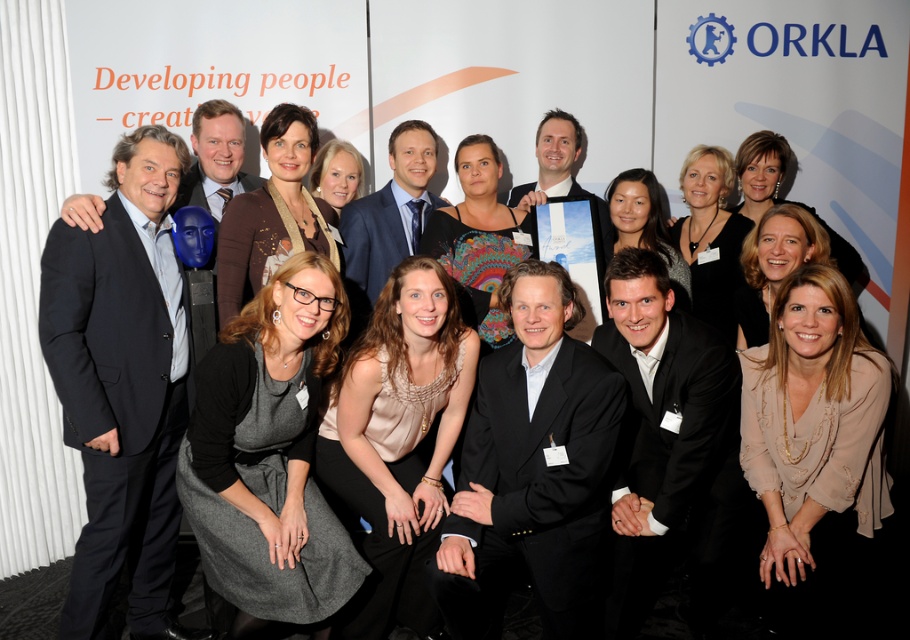
You are a photographer at the event and need to ensure everyone fits in the photo. The black suit at center and gray wool dress at center are currently overlapping. Which one should you ask to move slightly to the right to make space?

The black suit at center is bigger than the gray wool dress at center, so you should ask the black suit at center to move slightly to the right to create more space.

You are a photographer adjusting the camera focus. You need to ensure both the gray wool dress at center and the matte beige blouse at center are in focus. The camera has a depth of field that can cover 10 inches. Will both objects be in focus?

The distance between the gray wool dress at center and the matte beige blouse at center is 10.48 inches. Since the depth of field can cover 10 inches, the distance slightly exceeds the coverage, so both objects may not be fully in focus.

You are a photographer at the event and need to adjust the lighting to ensure both the dark blue suit at left and the gray wool dress at center are well lit. Given their sizes, which one might require more focused lighting to avoid being overshadowed?

The dark blue suit at left has a larger size compared to the gray wool dress at center, so it might require more focused lighting to ensure it doesn not overshadow the smaller gray wool dress at center.